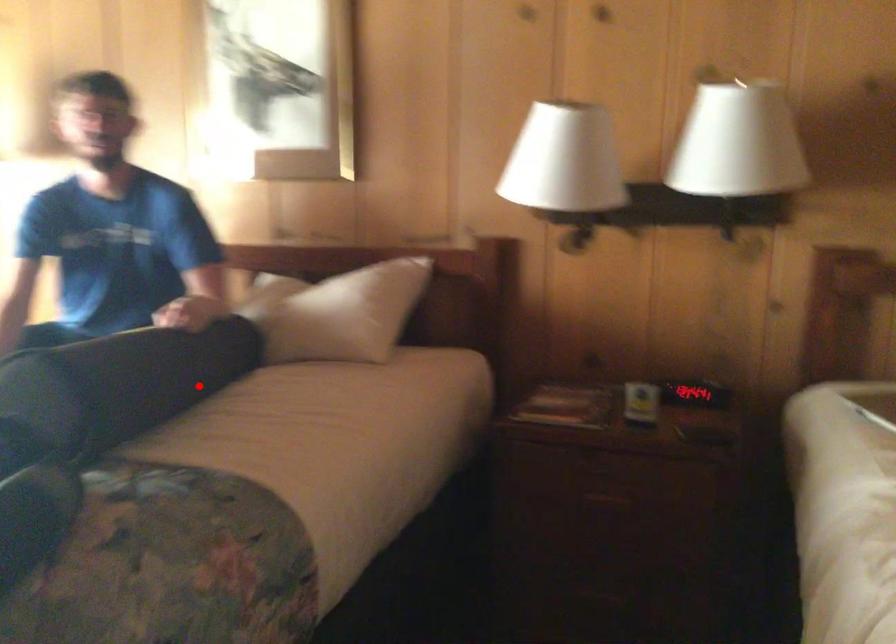
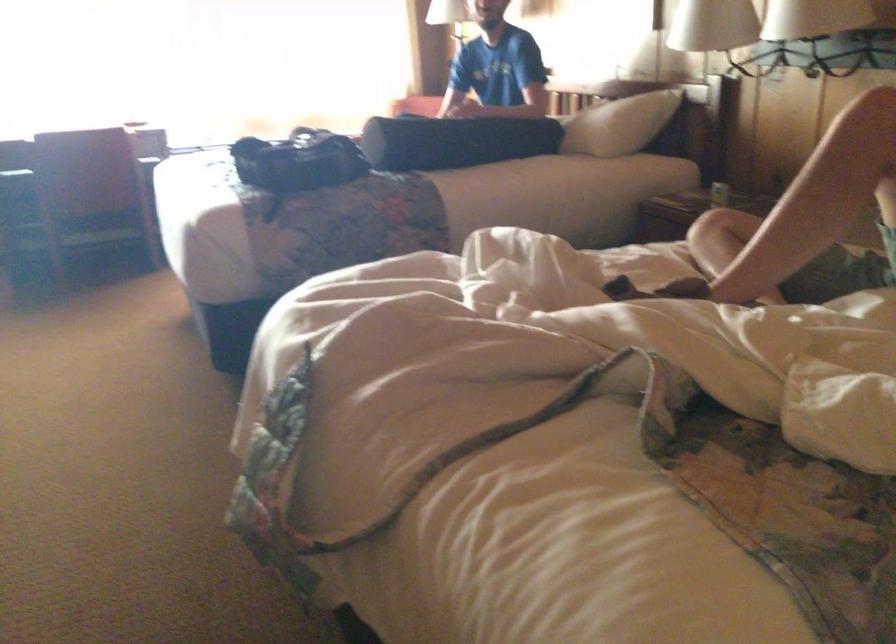
The point at the highlighted location is marked in the first image. Where is the corresponding point in the second image?

(454, 140)